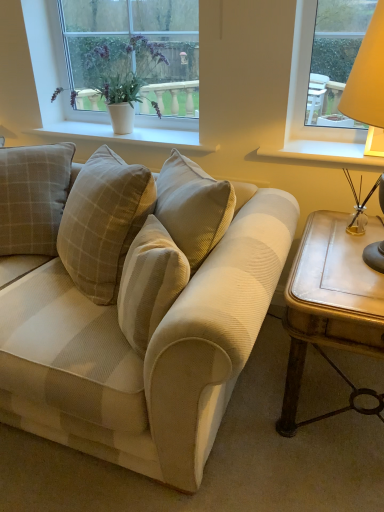
I want to click on vacant space situated above metallic gold table at right (from a real-world perspective), so click(343, 258).